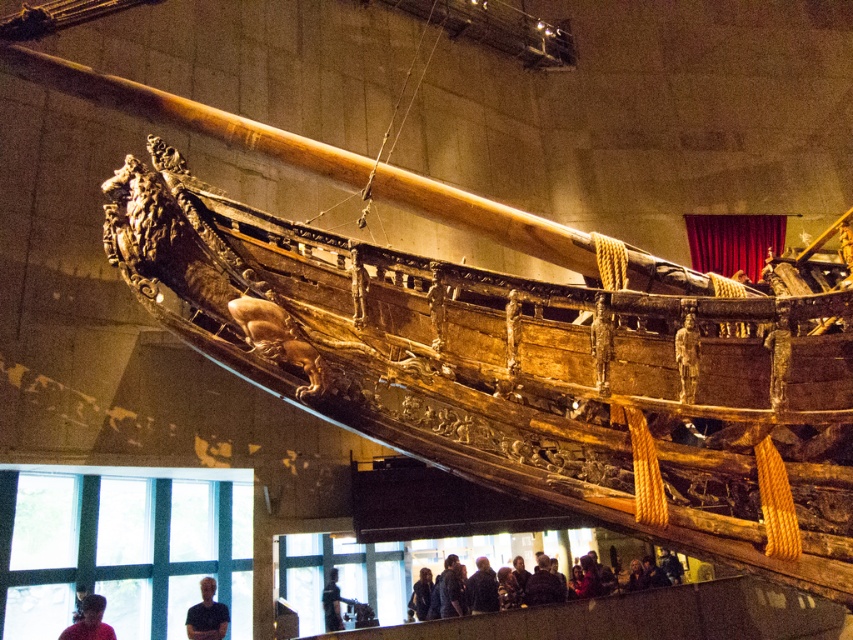
You are an interior designer planning to move the wooden ship at center and the dark blue shirt at lower left to a new exhibition space. The new space has a narrow corridor that is 2 meters wide. Can both items be moved through the corridor side by side without rotating them?

The wooden ship at center is wider than the dark blue shirt at lower left. Since the corridor is 2 meters wide, the combined width of both items may exceed the corridor width, making it difficult to move them side by side without rotating them.

You are a visitor at the museum and want to take a photo of the wooden ship at center without any obstructions. Is the dark gray fabric jacket at lower center blocking your view of the ship?

The wooden ship at center is located above the dark gray fabric jacket at lower center, so the jacket is below the ship and not blocking the view. You can take a clear photo of the wooden ship at center without any obstruction from the jacket.